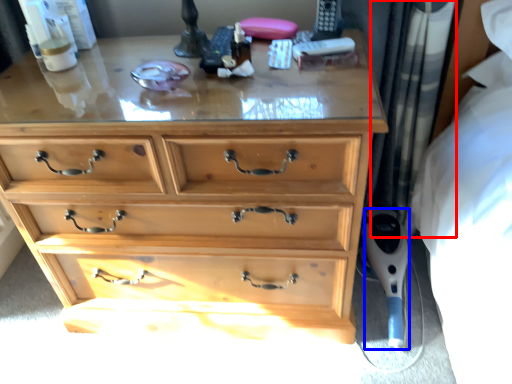
Question: Among these objects, which one is farthest to the camera, curtain (highlighted by a red box) or equipment (highlighted by a blue box)?

Choices:
 (A) curtain
 (B) equipment

Answer: (B)